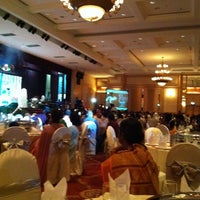
Locate an element on the screen. The width and height of the screenshot is (200, 200). exit sign is located at coordinates (194, 101).